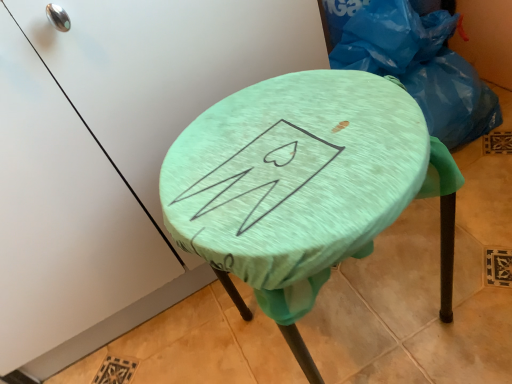
Where is `spots to the right of mint fabric-covered stool at center`? This screenshot has height=384, width=512. spots to the right of mint fabric-covered stool at center is located at coordinates (460, 256).